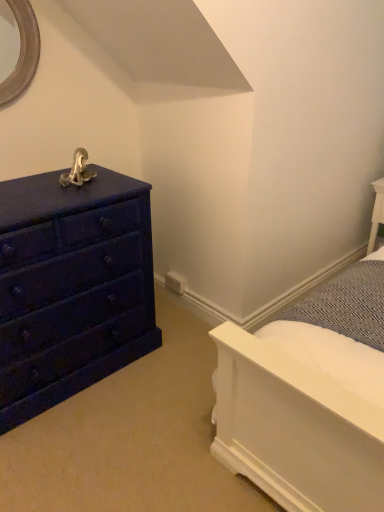
Measure the distance between point [124,362] and camera.

Point [124,362] is 7.05 feet away from camera.

Where is `matte dark blue dresser at left`? The image size is (384, 512). matte dark blue dresser at left is located at coordinates [x=71, y=287].

The height and width of the screenshot is (512, 384). What do you see at coordinates (71, 287) in the screenshot?
I see `matte dark blue dresser at left` at bounding box center [71, 287].

Locate an element on the screen. Image resolution: width=384 pixels, height=512 pixels. white textured fabric at upper right is located at coordinates (347, 304).

The image size is (384, 512). What do you see at coordinates (347, 304) in the screenshot? I see `white textured fabric at upper right` at bounding box center [347, 304].

Locate an element on the screen. matte dark blue dresser at left is located at coordinates (71, 287).

In the scene shown: In the image, is matte dark blue dresser at left on the left side or the right side of white textured fabric at upper right?

matte dark blue dresser at left is positioned on white textured fabric at upper right's left side.

Which object is further away from the camera taking this photo, matte dark blue dresser at left or white textured fabric at upper right?

Positioned behind is white textured fabric at upper right.

Does point (115, 244) appear closer or farther from the camera than point (365, 336)?

Point (115, 244) is positioned farther from the camera compared to point (365, 336).

From the image's perspective, is matte dark blue dresser at left beneath white textured fabric at upper right?

No, from the image's perspective, matte dark blue dresser at left is not below white textured fabric at upper right.

From a real-world perspective, is matte dark blue dresser at left above or below white textured fabric at upper right?

matte dark blue dresser at left is above white textured fabric at upper right.

Looking at this image, can you confirm if matte dark blue dresser at left is thinner than white textured fabric at upper right?

No, matte dark blue dresser at left is not thinner than white textured fabric at upper right.

Does matte dark blue dresser at left have a lesser height compared to white textured fabric at upper right?

No, matte dark blue dresser at left is not shorter than white textured fabric at upper right.

Who is smaller, matte dark blue dresser at left or white textured fabric at upper right?

Smaller between the two is white textured fabric at upper right.

Is matte dark blue dresser at left situated inside white textured fabric at upper right or outside?

matte dark blue dresser at left lies outside white textured fabric at upper right.

Is matte dark blue dresser at left beside white textured fabric at upper right?

No.

Could you tell me if matte dark blue dresser at left is facing white textured fabric at upper right?

No, matte dark blue dresser at left is not turned towards white textured fabric at upper right.

Locate an element on the screen. The width and height of the screenshot is (384, 512). bedding that is under the matte dark blue dresser at left (from a real-world perspective) is located at coordinates coord(347,304).

Considering the relative positions of white textured fabric at upper right and matte dark blue dresser at left in the image provided, is white textured fabric at upper right to the left of matte dark blue dresser at left from the viewer's perspective?

In fact, white textured fabric at upper right is to the right of matte dark blue dresser at left.

Is the position of white textured fabric at upper right less distant than that of matte dark blue dresser at left?

No, it is not.

Which point is more distant from viewer, (345, 331) or (107, 207)?

The point (107, 207) is farther.

From the image's perspective, is white textured fabric at upper right above or below matte dark blue dresser at left?

white textured fabric at upper right is situated lower than matte dark blue dresser at left in the image.

Looking at this image, from a real-world perspective, between white textured fabric at upper right and matte dark blue dresser at left, who is vertically lower?

white textured fabric at upper right, from a real-world perspective.

Which object is thinner, white textured fabric at upper right or matte dark blue dresser at left?

With smaller width is white textured fabric at upper right.

Considering the relative sizes of white textured fabric at upper right and matte dark blue dresser at left in the image provided, is white textured fabric at upper right taller than matte dark blue dresser at left?

No, white textured fabric at upper right is not taller than matte dark blue dresser at left.

Considering the relative sizes of white textured fabric at upper right and matte dark blue dresser at left in the image provided, is white textured fabric at upper right bigger than matte dark blue dresser at left?

Actually, white textured fabric at upper right might be smaller than matte dark blue dresser at left.

Is white textured fabric at upper right not inside matte dark blue dresser at left?

That's correct, white textured fabric at upper right is outside of matte dark blue dresser at left.

Is white textured fabric at upper right placed right next to matte dark blue dresser at left?

white textured fabric at upper right and matte dark blue dresser at left are clearly separated.

Is matte dark blue dresser at left at the back of white textured fabric at upper right?

No, white textured fabric at upper right's orientation is not away from matte dark blue dresser at left.

What's the angular difference between white textured fabric at upper right and matte dark blue dresser at left's facing directions?

1.66 degrees.

How much distance is there between white textured fabric at upper right and matte dark blue dresser at left?

A distance of 36.74 inches exists between white textured fabric at upper right and matte dark blue dresser at left.

Find the location of a particular element. The width and height of the screenshot is (384, 512). bedding behind the matte dark blue dresser at left is located at coordinates (347, 304).

At what (x,y) coordinates should I click in order to perform the action: click on the chest of drawers in front of the white textured fabric at upper right. Please return your answer as a coordinate pair (x, y). The image size is (384, 512). Looking at the image, I should click on 71,287.

At what (x,y) coordinates should I click in order to perform the action: click on bedding that appears on the right of matte dark blue dresser at left. Please return your answer as a coordinate pair (x, y). This screenshot has height=512, width=384. Looking at the image, I should click on (347, 304).